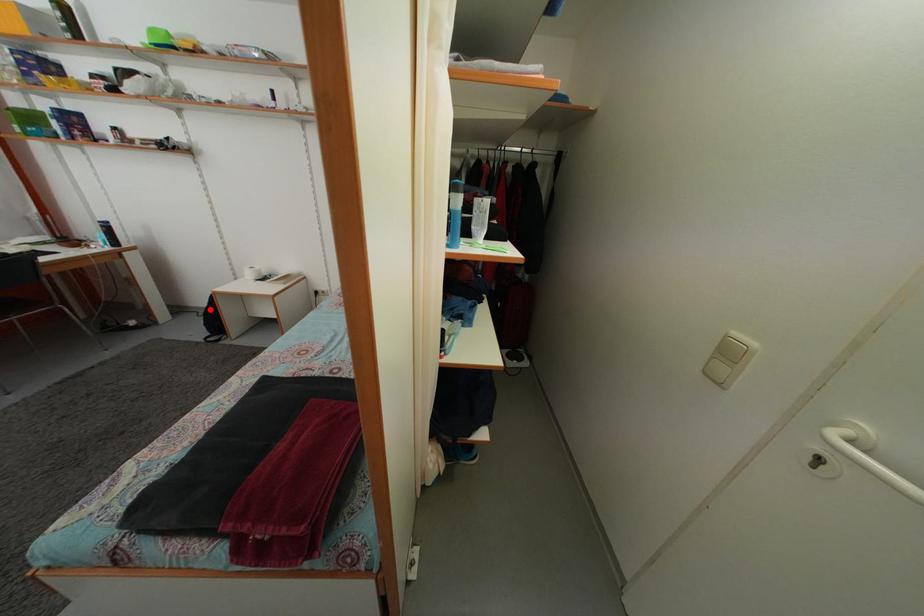
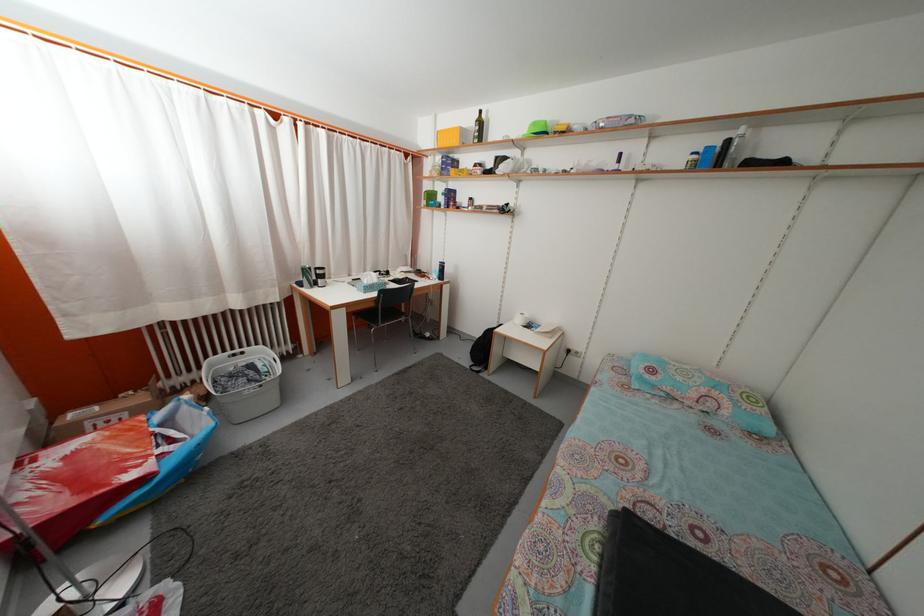
Where in the second image is the point corresponding to the highlighted location from the first image?

(482, 342)